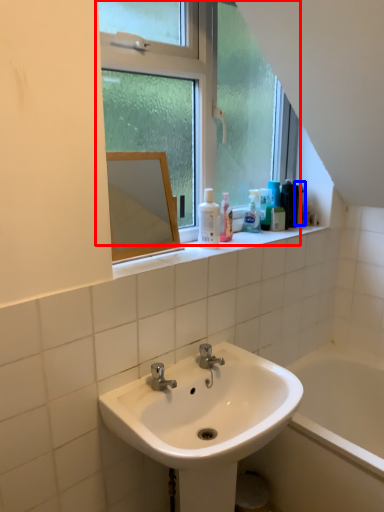
Question: Which object appears closest to the camera in this image, window (highlighted by a red box) or mouthwash (highlighted by a blue box)?

Choices:
 (A) window
 (B) mouthwash

Answer: (A)